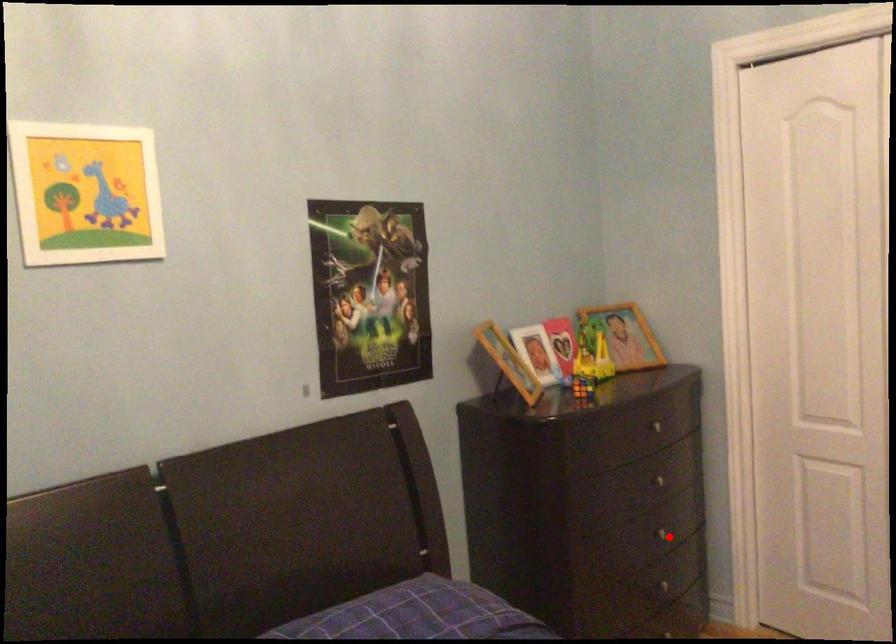
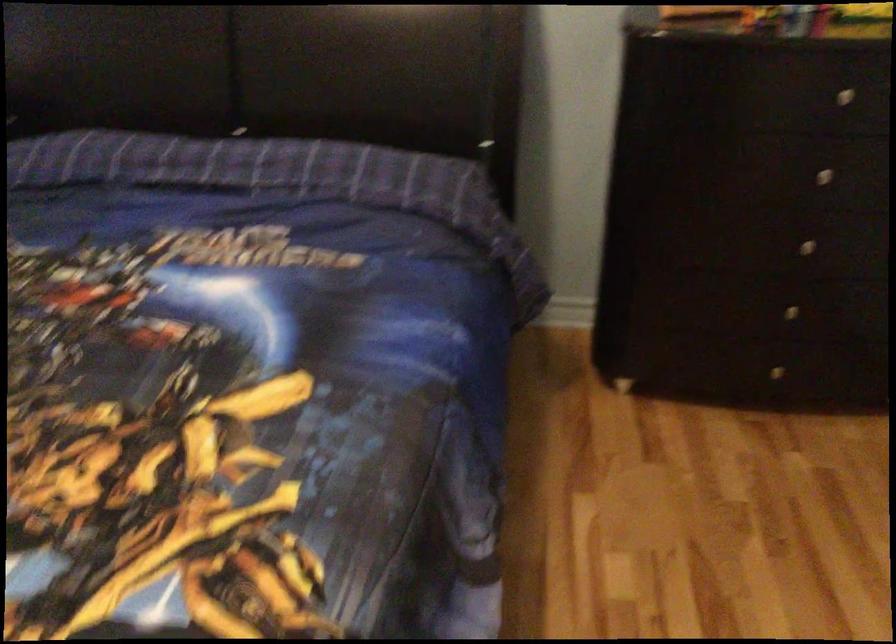
Question: I am providing you with two images of the same scene from different viewpoints. In image1, a red point is highlighted. Considering the same 3D point in image2, which of the following is correct?

Choices:
 (A) It is closer
 (B) It is farther

Answer: (A)